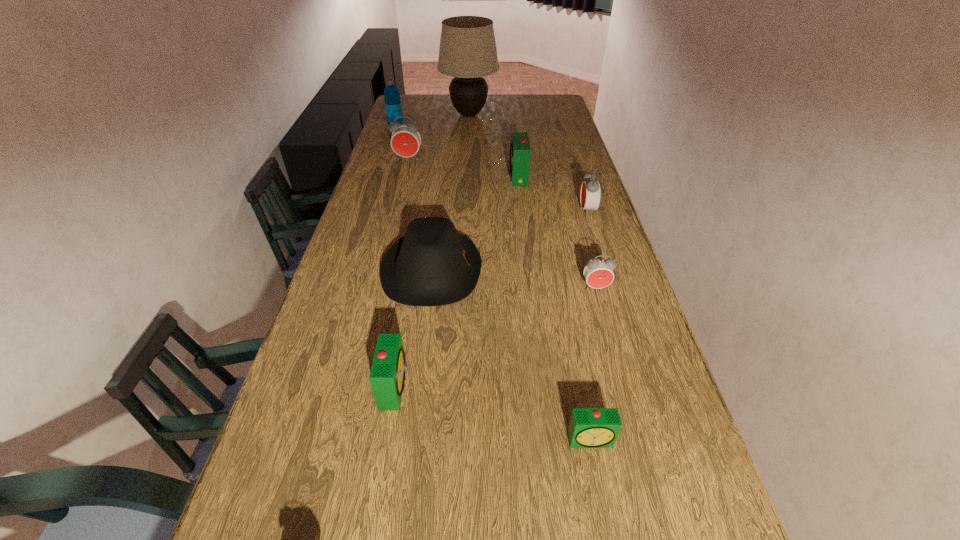
I want to click on the nearest red alarm clock, so click(x=598, y=273).

Find the location of a particular element. the second alarm clock from left to right is located at coordinates (387, 376).

This screenshot has width=960, height=540. I want to click on the leftmost green alarm clock, so click(x=387, y=376).

Find the location of `the smallest green alarm clock`. the smallest green alarm clock is located at coordinates (589, 427).

The height and width of the screenshot is (540, 960). What are the coordinates of `the nearest alarm clock` in the screenshot? It's located at [x=589, y=427].

Where is `vacant region located on the front of the tallest object`? vacant region located on the front of the tallest object is located at coordinates (467, 161).

Where is `vacant space located 0.150m on the back of the leftmost object`? vacant space located 0.150m on the back of the leftmost object is located at coordinates (401, 109).

At what (x,y) coordinates should I click in order to perform the action: click on blank space located 0.090m on the face of the farthest alarm clock. Please return your answer as a coordinate pair (x, y). Looking at the image, I should click on (404, 174).

Locate an element on the screen. The width and height of the screenshot is (960, 540). free region located 0.100m on the face of the second farthest red alarm clock is located at coordinates (550, 211).

Locate an element on the screen. Image resolution: width=960 pixels, height=540 pixels. free space located on the face of the second farthest red alarm clock is located at coordinates (500, 211).